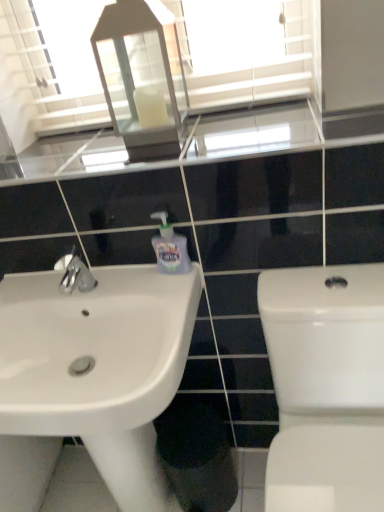
The height and width of the screenshot is (512, 384). I want to click on free region on the left part of translucent plastic soap dispenser at center, so click(122, 281).